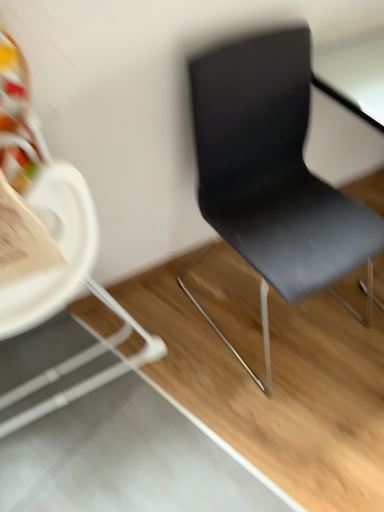
Question: Considering the positions of matte black chair at right, which ranks as the first chair in left-to-right order, and matte black chair at right, the second chair positioned from the left, in the image, is matte black chair at right, which ranks as the first chair in left-to-right order, wider or thinner than matte black chair at right, the second chair positioned from the left,?

Choices:
 (A) wide
 (B) thin

Answer: (B)

Question: From a real-world perspective, is matte black chair at right, which is the second chair in right-to-left order, positioned above or below matte black chair at right, the second chair positioned from the left?

Choices:
 (A) below
 (B) above

Answer: (B)

Question: Is matte black chair at right, which is the second chair in right-to-left order, situated inside matte black chair at right, arranged as the first chair when viewed from the right, or outside?

Choices:
 (A) outside
 (B) inside

Answer: (A)

Question: Looking at the image, does matte black chair at right, the second chair positioned from the left, seem bigger or smaller compared to matte black chair at right, which is the second chair in right-to-left order?

Choices:
 (A) big
 (B) small

Answer: (B)

Question: Does point (223, 337) appear closer or farther from the camera than point (36, 182)?

Choices:
 (A) farther
 (B) closer

Answer: (A)

Question: Would you say matte black chair at right, the second chair positioned from the left, is inside or outside matte black chair at right, which ranks as the first chair in left-to-right order?

Choices:
 (A) outside
 (B) inside

Answer: (A)

Question: From a real-world perspective, is matte black chair at right, the second chair positioned from the left, above or below matte black chair at right, which ranks as the first chair in left-to-right order?

Choices:
 (A) below
 (B) above

Answer: (A)